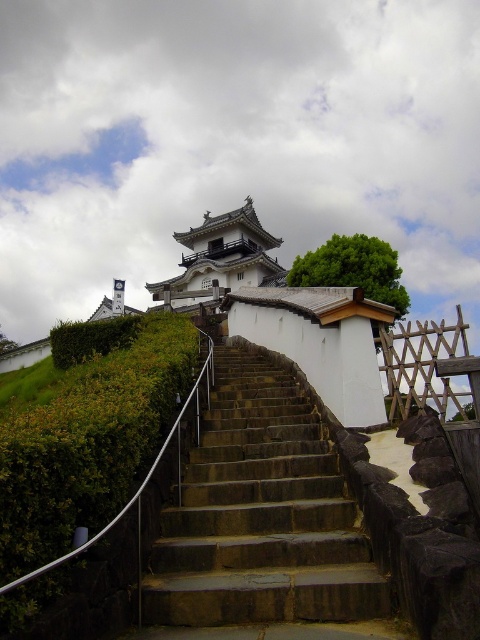
What do you see at coordinates (263, 524) in the screenshot?
I see `stone stairs at center` at bounding box center [263, 524].

Which of these two, stone stairs at center or green leafy hedge at lower left, stands taller?

With more height is green leafy hedge at lower left.

Is point (200, 449) closer to viewer compared to point (122, 444)?

That is False.

Where is `stone stairs at center`? The image size is (480, 640). stone stairs at center is located at coordinates (263, 524).

Consider the image. Who is more distant from viewer, [204,554] or [217,244]?

The point [217,244] is more distant.

Does stone stairs at center have a smaller size compared to white stone temple at upper center?

Yes.

Image resolution: width=480 pixels, height=640 pixels. What do you see at coordinates (263, 524) in the screenshot?
I see `stone stairs at center` at bounding box center [263, 524].

At what (x,y) coordinates should I click in order to perform the action: click on stone stairs at center. Please return your answer as a coordinate pair (x, y). Looking at the image, I should click on (263, 524).

How distant is white stone temple at upper center from green leafy hedge at upper left?

439.84 feet

Who is higher up, white stone temple at upper center or green leafy hedge at upper left?

white stone temple at upper center

Find the location of a particular element. white stone temple at upper center is located at coordinates (220, 260).

The image size is (480, 640). I want to click on white stone temple at upper center, so click(220, 260).